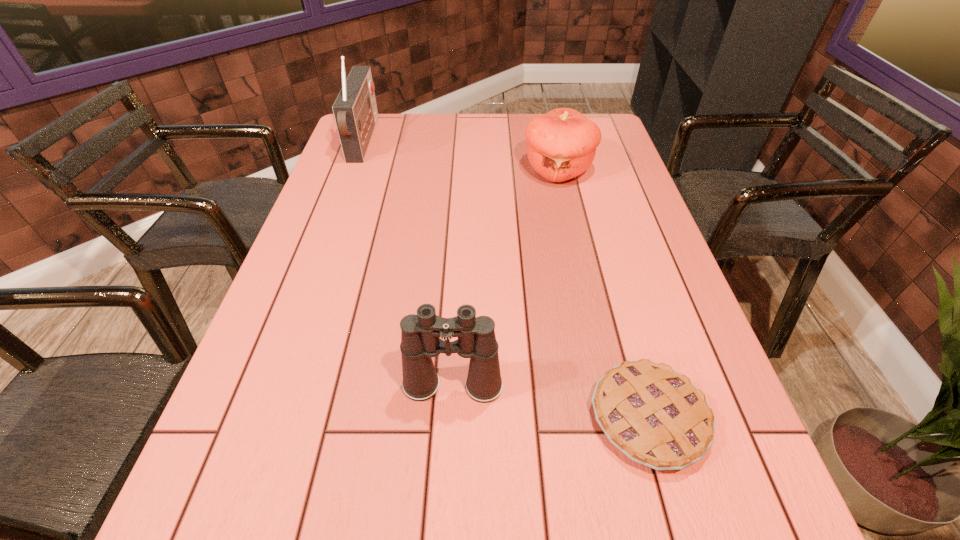
Identify which object is the third nearest to the radio receiver. Please provide its 2D coordinates. Your answer should be formatted as a tuple, i.e. [(x, y)], where the tuple contains the x and y coordinates of a point satisfying the conditions above.

[(657, 417)]

This screenshot has height=540, width=960. I want to click on vacant area that satisfies the following two spatial constraints: 1. on the front panel of the pie; 2. on the left side of the radio receiver, so click(264, 418).

Find the location of a particular element. vacant area in the image that satisfies the following two spatial constraints: 1. on the front panel of the binoculars; 2. on the left side of the tallest object is located at coordinates (276, 386).

I want to click on vacant space that satisfies the following two spatial constraints: 1. on the front panel of the radio receiver; 2. on the left side of the third shortest object, so pos(276,386).

Where is `free space that satisfies the following two spatial constraints: 1. on the front side of the pumpkin; 2. on the left side of the pie`? free space that satisfies the following two spatial constraints: 1. on the front side of the pumpkin; 2. on the left side of the pie is located at coordinates (612, 418).

This screenshot has width=960, height=540. I want to click on free region that satisfies the following two spatial constraints: 1. on the front panel of the pie; 2. on the left side of the radio receiver, so click(264, 418).

This screenshot has height=540, width=960. I want to click on free spot that satisfies the following two spatial constraints: 1. on the front panel of the tallest object; 2. on the left side of the pumpkin, so click(x=353, y=171).

In order to click on free region that satisfies the following two spatial constraints: 1. on the front panel of the pumpkin; 2. on the left side of the radio receiver in this screenshot , I will do `click(353, 171)`.

Locate an element on the screen. Image resolution: width=960 pixels, height=540 pixels. free space that satisfies the following two spatial constraints: 1. on the back side of the shortest object; 2. on the front panel of the tallest object is located at coordinates (570, 141).

The width and height of the screenshot is (960, 540). In order to click on free point that satisfies the following two spatial constraints: 1. on the front panel of the leftmost object; 2. on the left side of the pumpkin in this screenshot , I will do `click(353, 171)`.